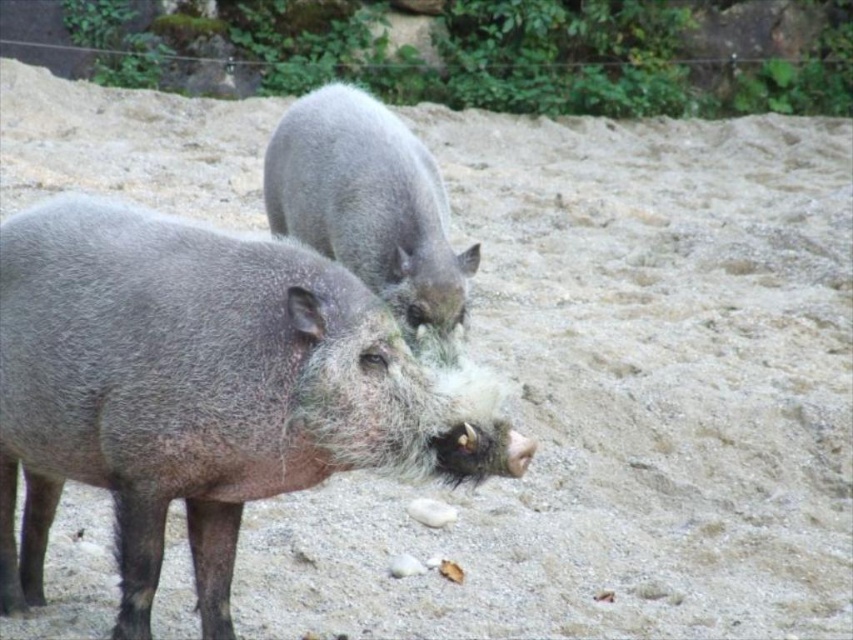
Question: Among these objects, which one is farthest from the camera?

Choices:
 (A) gray fuzzy boar at center
 (B) fuzzy gray pig at center

Answer: (B)

Question: Which of the following is the farthest from the observer?

Choices:
 (A) (337, 230)
 (B) (96, 397)

Answer: (A)

Question: Does gray fuzzy boar at center have a larger size compared to fuzzy gray pig at center?

Choices:
 (A) no
 (B) yes

Answer: (B)

Question: Which point is farther to the camera?

Choices:
 (A) (412, 308)
 (B) (86, 448)

Answer: (A)

Question: Is gray fuzzy boar at center positioned in front of fuzzy gray pig at center?

Choices:
 (A) no
 (B) yes

Answer: (B)

Question: Does gray fuzzy boar at center appear over fuzzy gray pig at center?

Choices:
 (A) no
 (B) yes

Answer: (A)